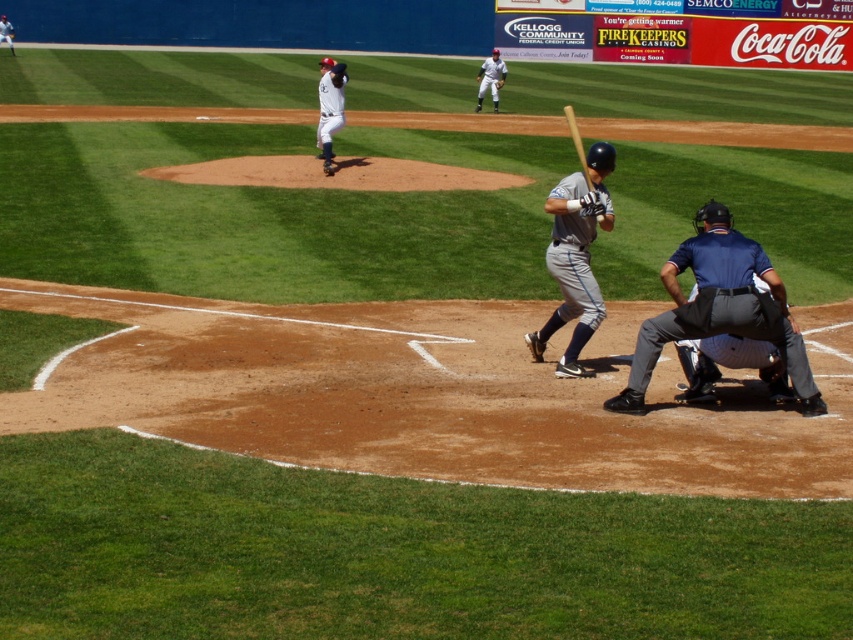
Question: Is dark blue uniform at lower right below brown leather glove at center?

Choices:
 (A) no
 (B) yes

Answer: (B)

Question: Does dark blue uniform at lower right appear under wooden baseball bat at center?

Choices:
 (A) yes
 (B) no

Answer: (A)

Question: Is the position of white matte uniform at upper center less distant than that of white uniform at upper center?

Choices:
 (A) no
 (B) yes

Answer: (B)

Question: Which object appears farthest from the camera in this image?

Choices:
 (A) brown leather glove at lower center
 (B) gray matte uniform at center
 (C) wooden baseball bat at center
 (D) white matte uniform at upper center

Answer: (D)

Question: Which object appears closest to the camera in this image?

Choices:
 (A) gray matte uniform at center
 (B) gray uniformed player at center
 (C) brown leather glove at lower center
 (D) brown leather glove at center

Answer: (A)

Question: Which point is closer to the camera?

Choices:
 (A) (556, 252)
 (B) (322, 140)
 (C) (498, 80)

Answer: (A)